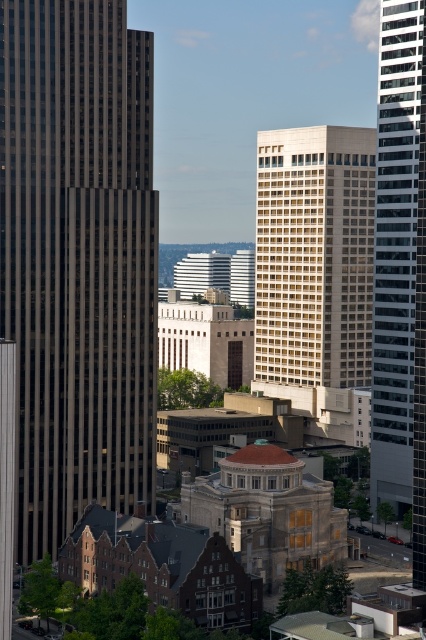
Between dark glass skyscraper at left and white textured building at center, which one has less height?

Standing shorter between the two is white textured building at center.

Is point (89, 424) positioned after point (261, 296)?

No, (89, 424) is closer to viewer.

Where is `dark glass skyscraper at left`? The image size is (426, 640). dark glass skyscraper at left is located at coordinates (77, 259).

Measure the distance from white textured building at center to glassy reflective skyscraper at right.

white textured building at center and glassy reflective skyscraper at right are 63.44 meters apart.

This screenshot has height=640, width=426. What do you see at coordinates (316, 269) in the screenshot?
I see `white textured building at center` at bounding box center [316, 269].

Is point (299, 257) positioned after point (397, 22)?

Yes.

Identify the location of white textured building at center. Image resolution: width=426 pixels, height=640 pixels. (316, 269).

Which is more to the left, dark glass skyscraper at left or glassy reflective skyscraper at right?

dark glass skyscraper at left is more to the left.

What do you see at coordinates (77, 259) in the screenshot? This screenshot has width=426, height=640. I see `dark glass skyscraper at left` at bounding box center [77, 259].

Who is more distant from viewer, (x=46, y=157) or (x=420, y=20)?

Point (x=420, y=20)

Where is `dark glass skyscraper at left`? This screenshot has height=640, width=426. dark glass skyscraper at left is located at coordinates (77, 259).